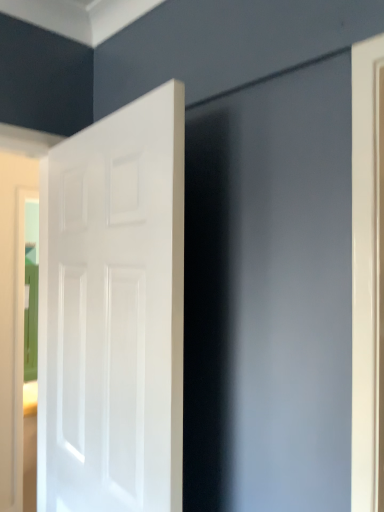
Measure the distance between point (150, 227) and camera.

The distance of point (150, 227) from camera is 39.17 inches.

Describe the element at coordinates (113, 312) in the screenshot. I see `white glossy door at left` at that location.

At what (x,y) coordinates should I click in order to perform the action: click on white glossy door at left. Please return your answer as a coordinate pair (x, y). The width and height of the screenshot is (384, 512). Looking at the image, I should click on (113, 312).

At what (x,y) coordinates should I click in order to perform the action: click on white glossy door at left. Please return your answer as a coordinate pair (x, y). The image size is (384, 512). Looking at the image, I should click on (113, 312).